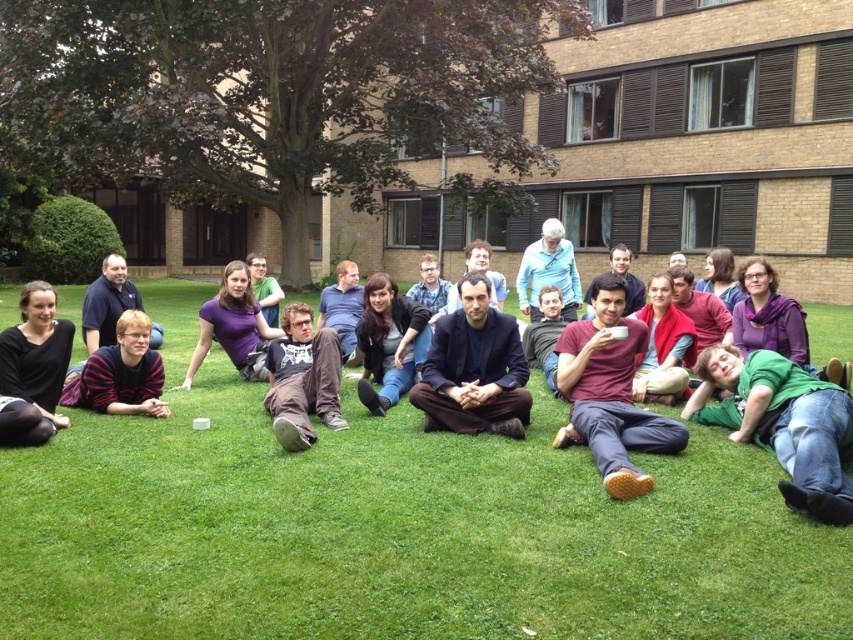
Question: Among these objects, which one is nearest to the camera?

Choices:
 (A) dark blue fabric at center
 (B) brown cotton pants at center

Answer: (B)

Question: Which point is closer to the camera?

Choices:
 (A) (788, 452)
 (B) (94, 384)
 (C) (494, 337)
 (D) (265, 340)

Answer: (A)

Question: Which of the following is the farthest from the observer?

Choices:
 (A) green grass at lower center
 (B) brown cotton pants at center
 (C) purple matte shirt at center

Answer: (C)

Question: Can you confirm if maroon fabric shirt at center is bigger than purple matte shirt at center?

Choices:
 (A) yes
 (B) no

Answer: (A)

Question: Can you confirm if dark blue fabric at center is thinner than black matte shirt at lower left?

Choices:
 (A) no
 (B) yes

Answer: (A)

Question: Can you confirm if green cotton shirt at lower right is bigger than striped cotton shirt at lower left?

Choices:
 (A) no
 (B) yes

Answer: (B)